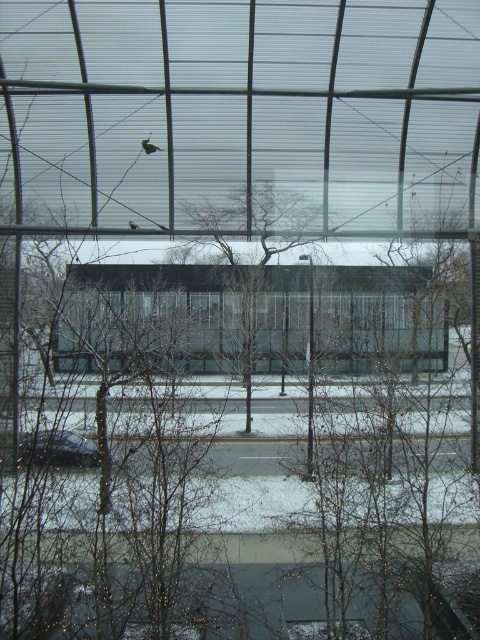
Question: Can you confirm if transparent glass window at center is positioned below bare branches at center?

Choices:
 (A) no
 (B) yes

Answer: (B)

Question: Which point is closer to the camera?

Choices:
 (A) shiny black car at lower left
 (B) bare branches at center
 (C) transparent glass window at center

Answer: (A)

Question: Does transparent glass window at center appear over shiny black car at lower left?

Choices:
 (A) no
 (B) yes

Answer: (B)

Question: Can you confirm if bare branches at center is positioned to the left of shiny black car at lower left?

Choices:
 (A) yes
 (B) no

Answer: (B)

Question: Which of these objects is positioned closest to the transparent glass window at center?

Choices:
 (A) bare branches at center
 (B) shiny black car at lower left

Answer: (A)

Question: Which object is farther from the camera taking this photo?

Choices:
 (A) bare branches at center
 (B) shiny black car at lower left
 (C) transparent glass window at center

Answer: (C)